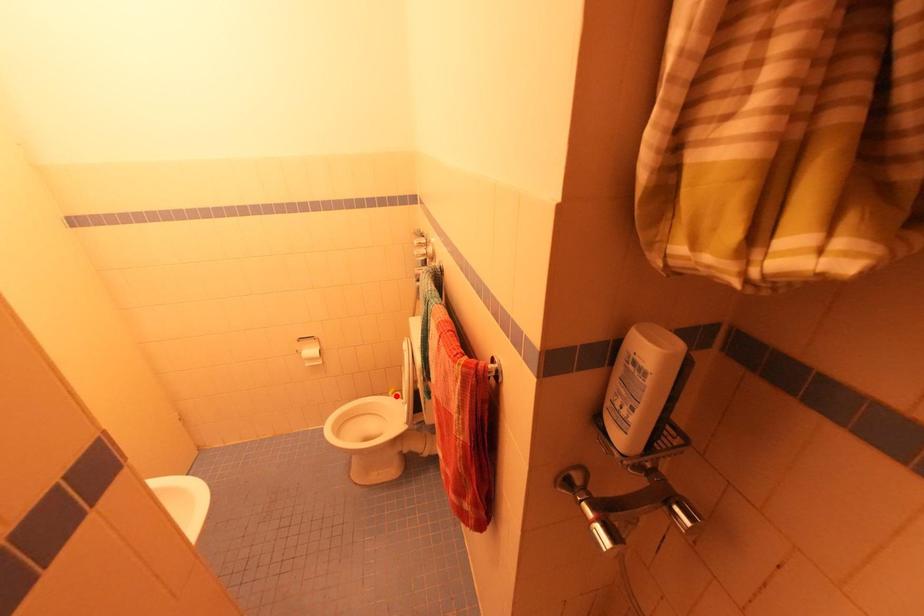
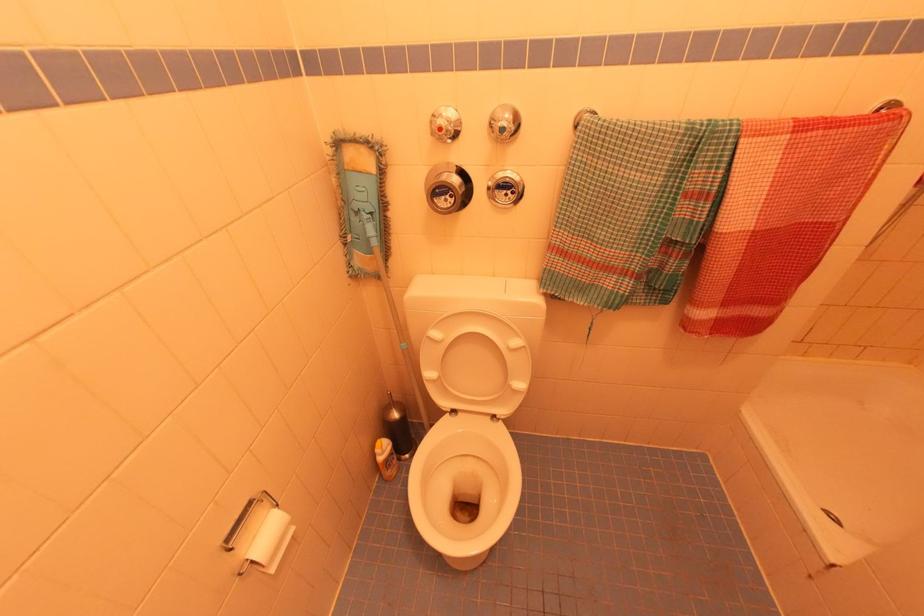
Where in the second image is the point corresponding to the highlighted location from the first image?

(385, 448)